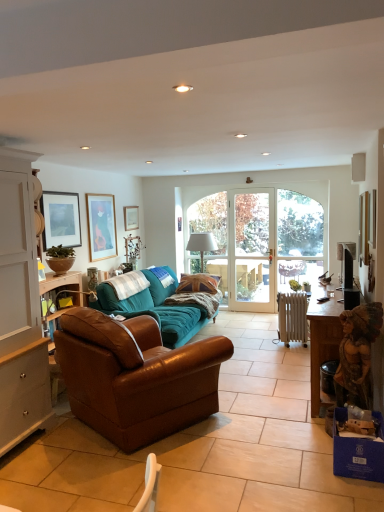
Question: From the image's perspective, does brown leather couch at center, acting as the 2th studio couch starting from the back, appear higher than gold-framed picture at upper left, the 2th picture frame in the left-to-right sequence?

Choices:
 (A) no
 (B) yes

Answer: (A)

Question: Would you say brown leather couch at center, acting as the 2th studio couch starting from the back, is a long distance from gold-framed picture at upper left, the third picture frame viewed from the right?

Choices:
 (A) yes
 (B) no

Answer: (A)

Question: From a real-world perspective, is brown leather couch at center, acting as the 2th studio couch starting from the back, located higher than gold-framed picture at upper left, which appears as the second picture frame when viewed from the back?

Choices:
 (A) yes
 (B) no

Answer: (B)

Question: From the image's perspective, is brown leather couch at center, acting as the 2th studio couch starting from the back, beneath gold-framed picture at upper left, which appears as the second picture frame when viewed from the back?

Choices:
 (A) no
 (B) yes

Answer: (B)

Question: Is the depth of brown leather couch at center, acting as the 2th studio couch starting from the back, less than that of gold-framed picture at upper left, the third picture frame viewed from the right?

Choices:
 (A) yes
 (B) no

Answer: (A)

Question: Considering the relative positions of brown leather couch at center, which is the 1th studio couch from front to back, and gold-framed picture at upper left, the 2th picture frame in the left-to-right sequence, in the image provided, is brown leather couch at center, which is the 1th studio couch from front to back, behind gold-framed picture at upper left, the 2th picture frame in the left-to-right sequence,?

Choices:
 (A) yes
 (B) no

Answer: (B)

Question: Could you tell me if white fabric lampshade at center is turned towards matte wooden picture frame at upper center, arranged as the fourth picture frame when viewed from the front?

Choices:
 (A) yes
 (B) no

Answer: (B)

Question: Can you confirm if white fabric lampshade at center is bigger than matte wooden picture frame at upper center, the second picture frame positioned from the right?

Choices:
 (A) no
 (B) yes

Answer: (B)

Question: Is white fabric lampshade at center positioned before matte wooden picture frame at upper center, which ranks as the first picture frame in back-to-front order?

Choices:
 (A) no
 (B) yes

Answer: (B)

Question: Is white fabric lampshade at center at the left side of matte wooden picture frame at upper center, arranged as the fourth picture frame when viewed from the front?

Choices:
 (A) no
 (B) yes

Answer: (A)

Question: Can matte wooden picture frame at upper center, arranged as the fourth picture frame when viewed from the front, be found inside white fabric lampshade at center?

Choices:
 (A) no
 (B) yes

Answer: (A)

Question: From the image's perspective, is white fabric lampshade at center located above matte wooden picture frame at upper center, the second picture frame positioned from the right?

Choices:
 (A) no
 (B) yes

Answer: (A)

Question: Is matte wooden picture frame at upper center, which ranks as the first picture frame in back-to-front order, next to clear glass door at center?

Choices:
 (A) yes
 (B) no

Answer: (B)